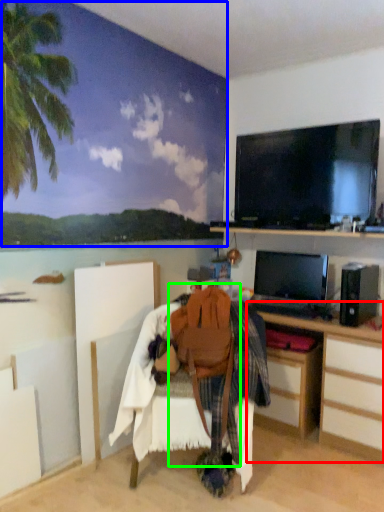
Question: Which object is positioned farthest from desk (highlighted by a red box)? Select from backdrop (highlighted by a blue box) and swivel chair (highlighted by a green box).

Choices:
 (A) backdrop
 (B) swivel chair

Answer: (A)